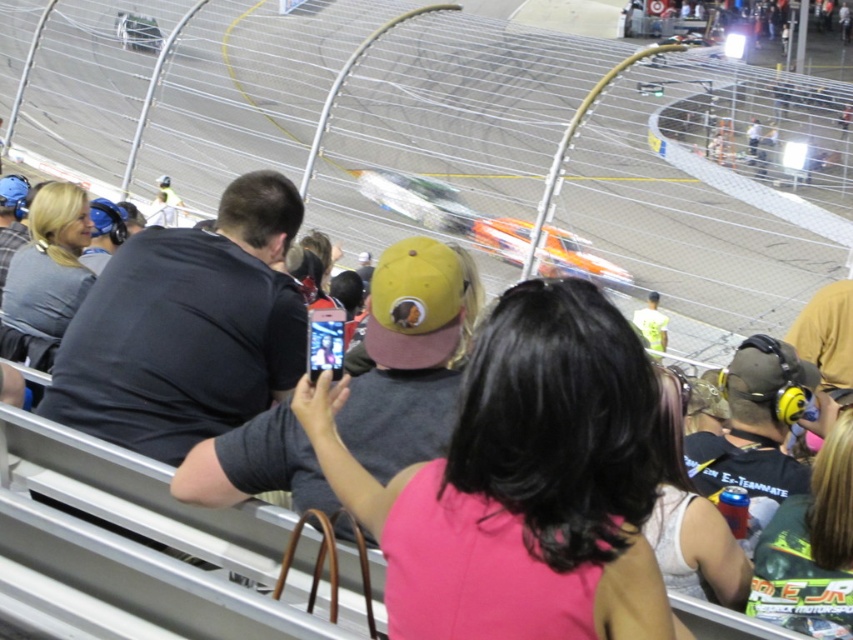
Between smooth asphalt race track at center and pink fabric shirt at center, which one has less height?

Standing shorter between the two is pink fabric shirt at center.

Does smooth asphalt race track at center have a lesser width compared to pink fabric shirt at center?

No.

The width and height of the screenshot is (853, 640). What do you see at coordinates (463, 141) in the screenshot?
I see `smooth asphalt race track at center` at bounding box center [463, 141].

Locate an element on the screen. The width and height of the screenshot is (853, 640). smooth asphalt race track at center is located at coordinates (463, 141).